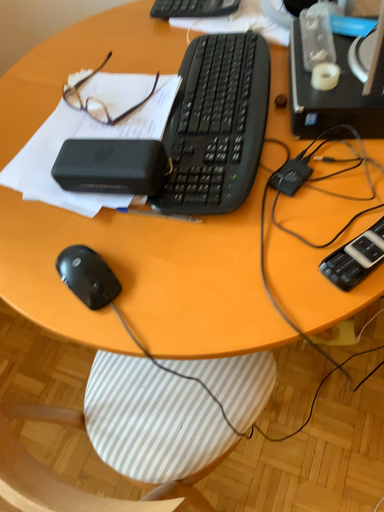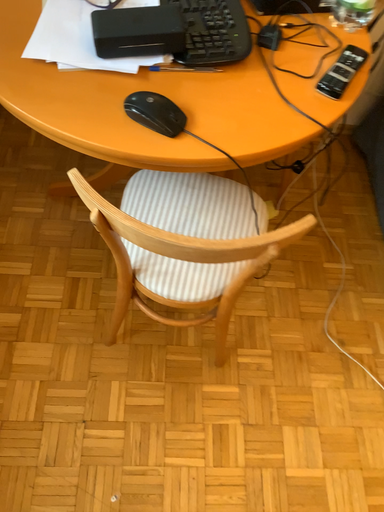
Question: Which way did the camera rotate in the video?

Choices:
 (A) rotated right
 (B) rotated left

Answer: (A)